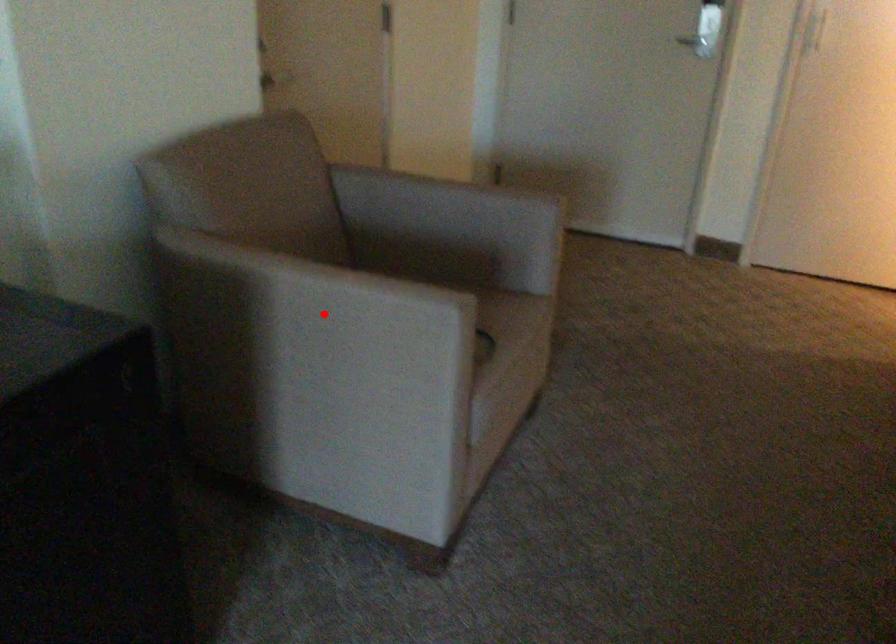
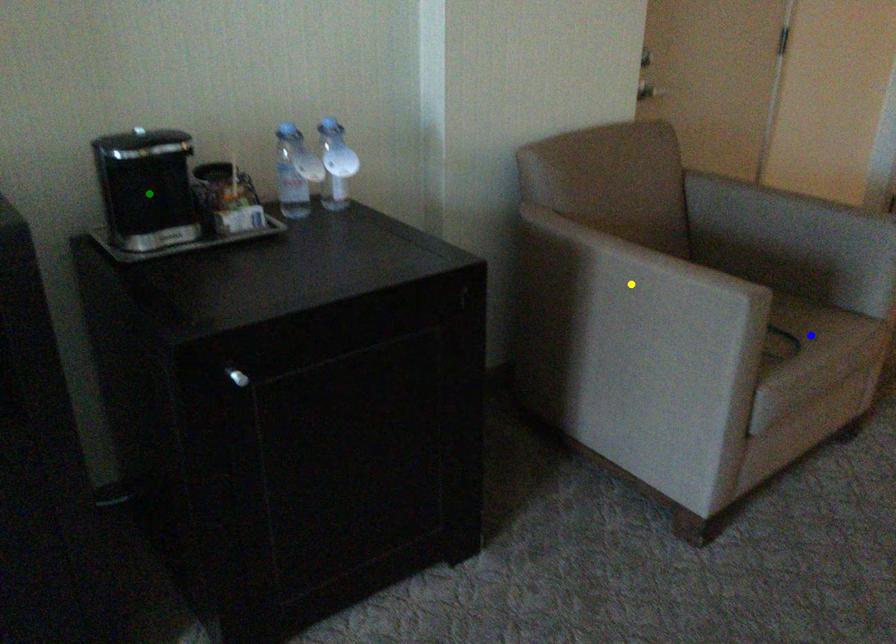
Question: I am providing you with two images of the same scene from different viewpoints. A red point is marked on the first image. You are given multiple points on the second image. Which point in image 2 represents the same 3d spot as the red point in image 1?

Choices:
 (A) yellow point
 (B) blue point
 (C) green point

Answer: (A)